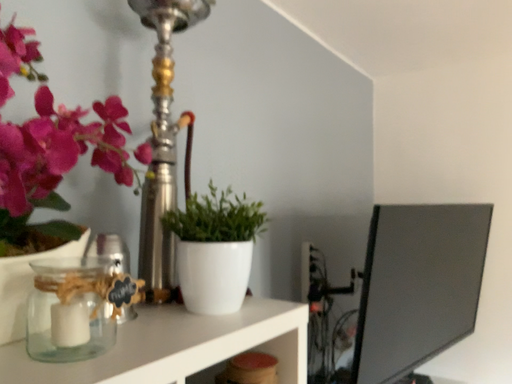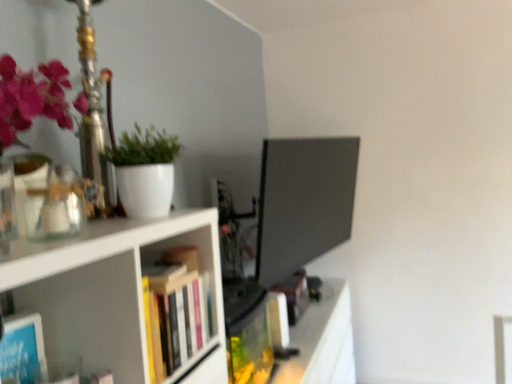
Question: Which way did the camera rotate in the video?

Choices:
 (A) rotated right
 (B) rotated left

Answer: (A)